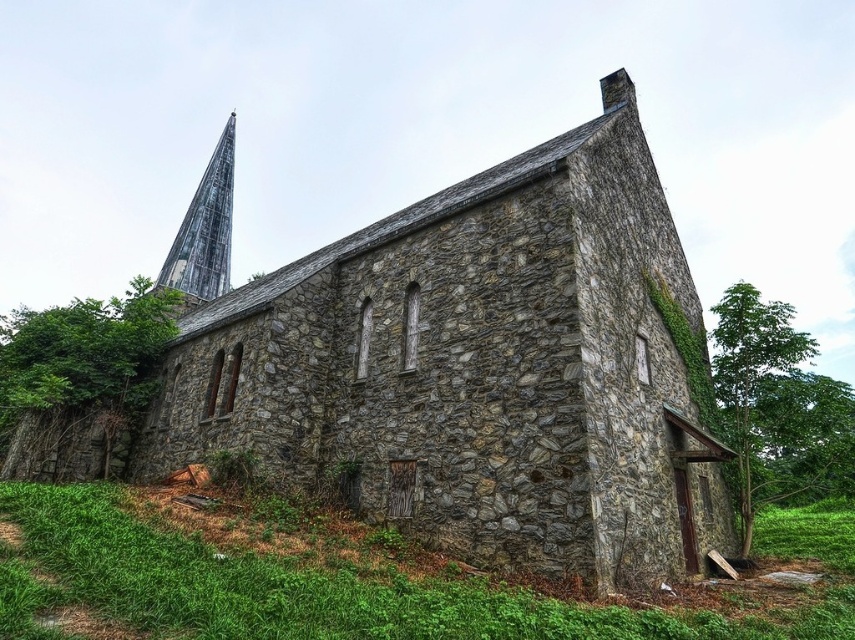
Question: Based on their relative distances, which object is farther from the green leafy tree at left?

Choices:
 (A) gray stone church at center
 (B) weathered gray stone spire at upper left

Answer: (B)

Question: Considering the relative positions of green grass at lower left and green leafy tree at left in the image provided, where is green grass at lower left located with respect to green leafy tree at left?

Choices:
 (A) left
 (B) right

Answer: (B)

Question: Does gray stone church at center appear on the left side of green leafy tree at right?

Choices:
 (A) no
 (B) yes

Answer: (B)

Question: Which object appears closest to the camera in this image?

Choices:
 (A) green grass at lower left
 (B) gray stone church at center
 (C) green leafy tree at right

Answer: (A)

Question: Is green grass at lower left closer to the viewer compared to green leafy tree at left?

Choices:
 (A) no
 (B) yes

Answer: (B)

Question: Which point is closer to the camera?

Choices:
 (A) gray stone church at center
 (B) weathered gray stone spire at upper left
 (C) green grass at lower left
 (D) green leafy tree at left

Answer: (C)